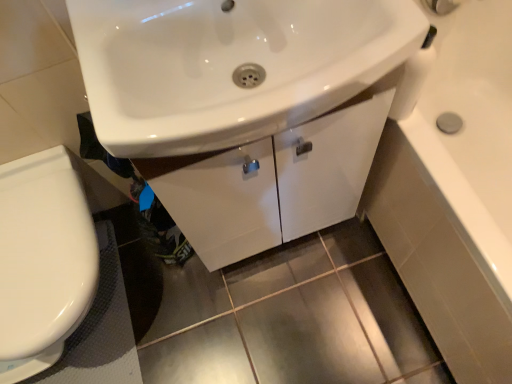
Question: Considering the positions of white glossy sink at center and white glossy faucet at upper center in the image, is white glossy sink at center bigger or smaller than white glossy faucet at upper center?

Choices:
 (A) small
 (B) big

Answer: (B)

Question: From the image's perspective, is white glossy sink at center located above or below white glossy faucet at upper center?

Choices:
 (A) below
 (B) above

Answer: (A)

Question: Which of these objects is positioned closest to the white glossy faucet at upper center?

Choices:
 (A) white glossy cabinet at center
 (B) black rubber bath mat at lower left
 (C) white glossy sink at center
 (D) white glossy toilet at lower left

Answer: (C)

Question: Which object is positioned closest to the black rubber bath mat at lower left?

Choices:
 (A) white glossy sink at center
 (B) white glossy faucet at upper center
 (C) white glossy toilet at lower left
 (D) white glossy cabinet at center

Answer: (C)